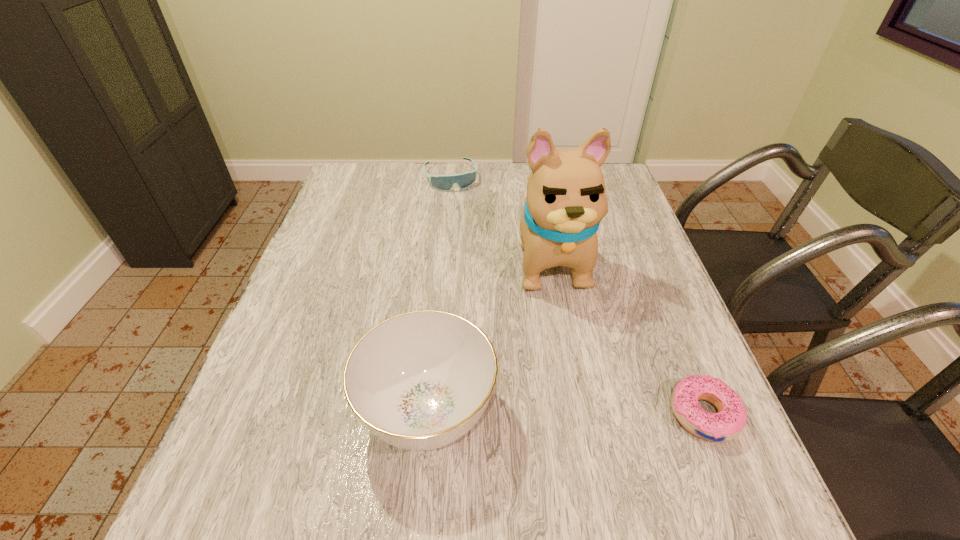
At what (x,y) coordinates should I click in order to perform the action: click on the third shortest object. Please return your answer as a coordinate pair (x, y). The height and width of the screenshot is (540, 960). Looking at the image, I should click on (420, 380).

Locate an element on the screen. This screenshot has width=960, height=540. the rightmost object is located at coordinates (727, 424).

At what (x,y) coordinates should I click in order to perform the action: click on doughnut. Please return your answer as a coordinate pair (x, y). Looking at the image, I should click on (727, 424).

Identify the location of the second object from right to left. This screenshot has height=540, width=960. (566, 200).

Find the location of a particular element. This screenshot has height=540, width=960. the second farthest object is located at coordinates (566, 200).

Locate an element on the screen. the farthest object is located at coordinates 464,180.

The height and width of the screenshot is (540, 960). Find the location of `vacant region located on the back of the chinaware`. vacant region located on the back of the chinaware is located at coordinates (444, 238).

Find the location of a particular element. vacant space located 0.250m on the left of the shortest object is located at coordinates (536, 414).

Identify the location of vacant region located 0.270m on the face of the second farthest object. (588, 407).

Locate an element on the screen. The height and width of the screenshot is (540, 960). blank space located 0.230m on the face of the second farthest object is located at coordinates (584, 389).